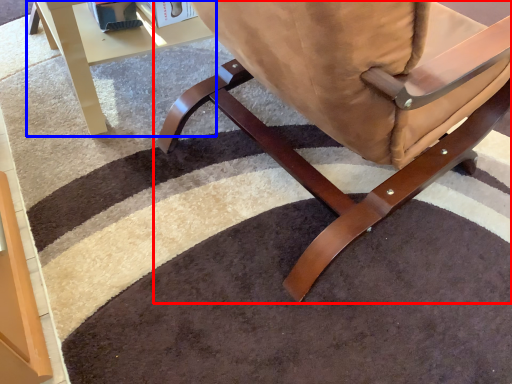
Question: Which object appears farthest to the camera in this image, chair (highlighted by a red box) or table (highlighted by a blue box)?

Choices:
 (A) chair
 (B) table

Answer: (B)